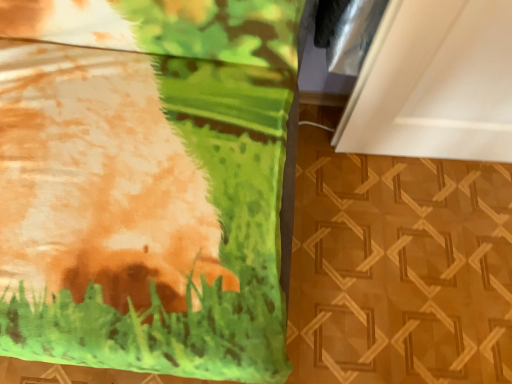
Question: Should I look upward or downward to see matte green blanket at upper left?

Choices:
 (A) down
 (B) up

Answer: (B)